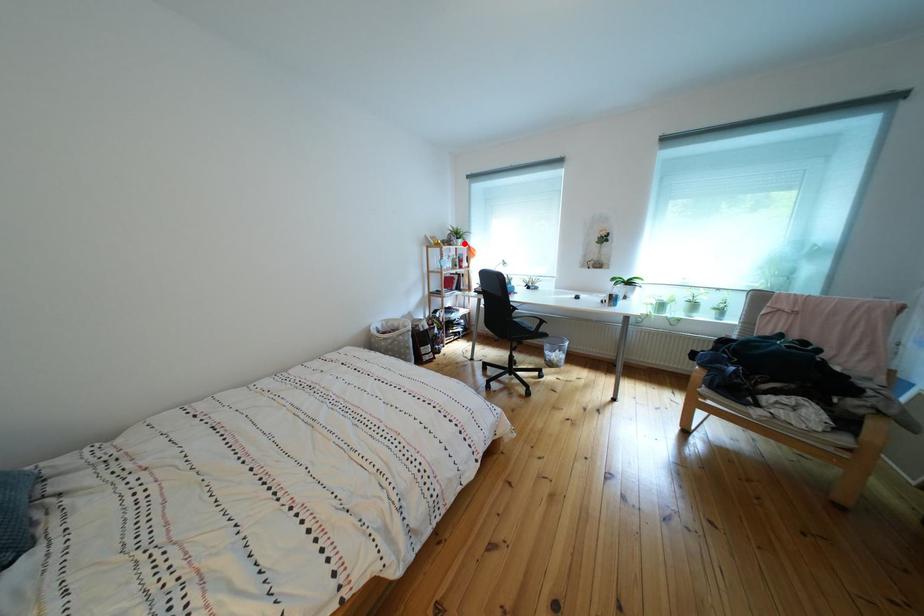
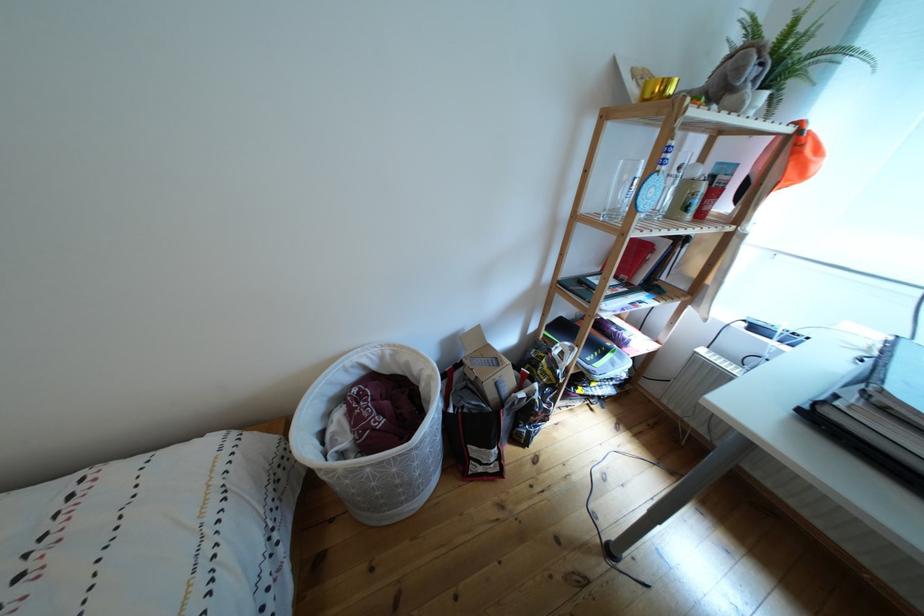
Question: I am providing you with two images of the same scene from different viewpoints. Given a red point in image1, look at the same physical point in image2. Is it:

Choices:
 (A) Closer to the viewpoint
 (B) Farther from the viewpoint

Answer: (B)